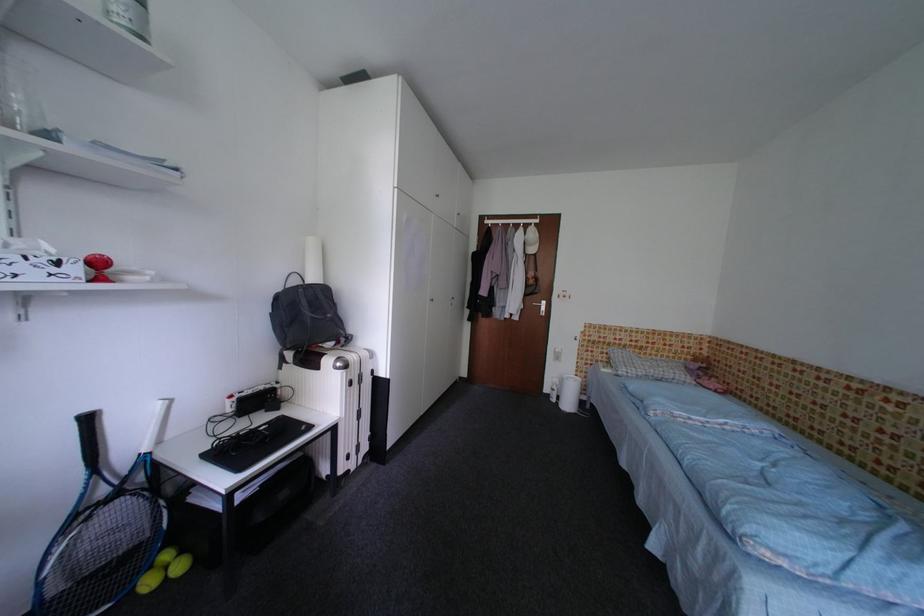
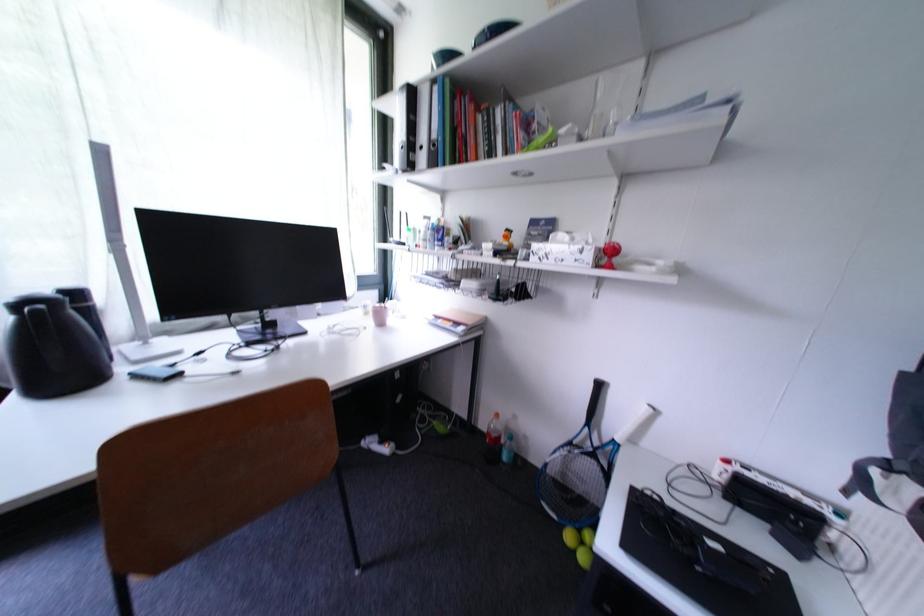
Where in the second image is the point corresponding to pixel 66 265 from the first image?

(590, 253)